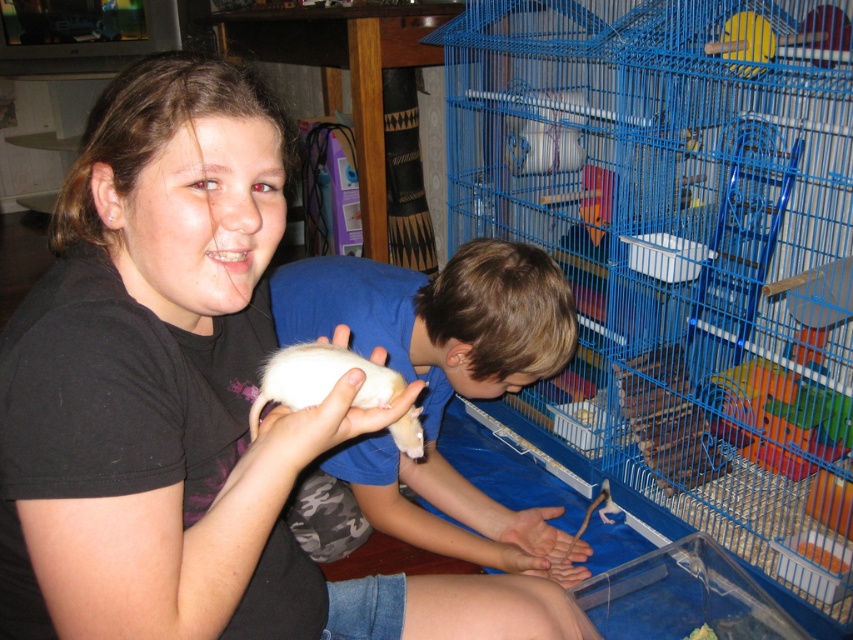
Does matte black shirt at upper left have a lesser height compared to white soft hamster at center?

No.

Which is above, matte black shirt at upper left or white soft hamster at center?

Positioned higher is white soft hamster at center.

Does point (114, 83) come farther from viewer compared to point (361, 388)?

No, (114, 83) is closer to viewer.

Image resolution: width=853 pixels, height=640 pixels. What are the coordinates of `matte black shirt at upper left` in the screenshot? It's located at (184, 397).

Can you confirm if blue wire cage at lower right is positioned to the left of matte black shirt at upper left?

In fact, blue wire cage at lower right is to the right of matte black shirt at upper left.

Is point (769, 208) positioned in front of point (164, 476)?

No, it is behind (164, 476).

Between point (755, 268) and point (187, 99), which one is positioned in front?

Point (187, 99) is in front.

At what (x,y) coordinates should I click in order to perform the action: click on blue wire cage at lower right. Please return your answer as a coordinate pair (x, y). Looking at the image, I should click on (682, 257).

Is point (555, 557) positioned after point (397, 374)?

Yes, point (555, 557) is farther from viewer.

Does white fur coat at center have a greater height compared to white soft hamster at center?

Yes.

Which is in front, point (383, 445) or point (300, 406)?

Positioned in front is point (300, 406).

Where is `white fur coat at center`? The height and width of the screenshot is (640, 853). white fur coat at center is located at coordinates 433,392.